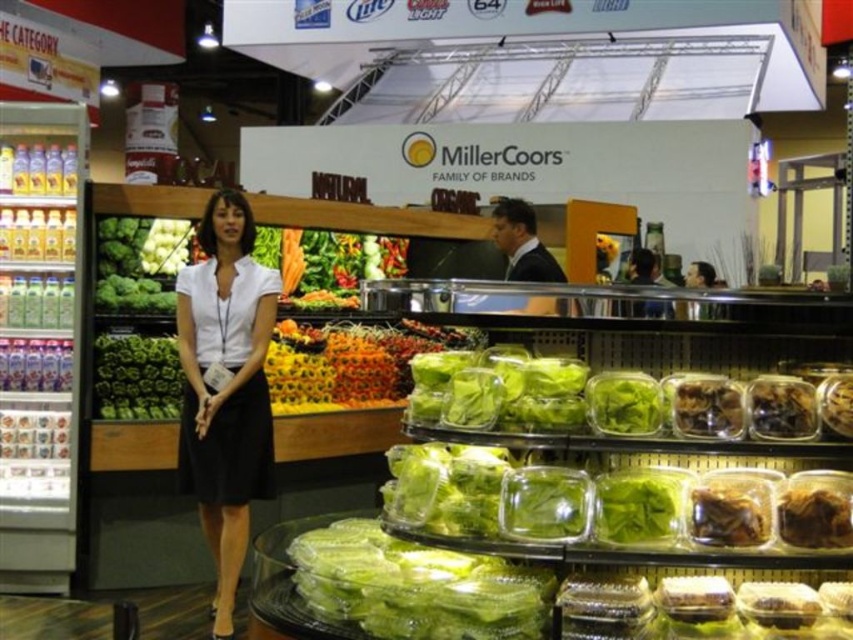
You are a customer in the store and want to grab the brown crumbly at lower right. Can you reach it without moving the green leafy lettuce at center?

The brown crumbly at lower right is behind the green leafy lettuce at center, so you can reach it without moving the green leafy lettuce at center because it is positioned behind it.

You are a customer in a grocery store and want to find the green leafy lettuce at center. According to the store layout, where should you look relative to the display case?

The green leafy lettuce at center is located at the coordinates point (135, 378) relative to the display case.